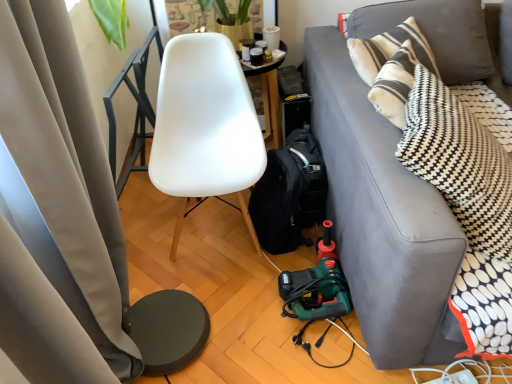
You are a GUI agent. You are given a task and a screenshot of the screen. Output one action in this format:
    pyautogui.click(x=<x>, y=<y>)
    Task: Click on the vacant area situated below matte gray curtain at left (from a real-world perspective)
    This screenshot has width=512, height=384.
    Given the screenshot: What is the action you would take?
    pyautogui.click(x=211, y=336)